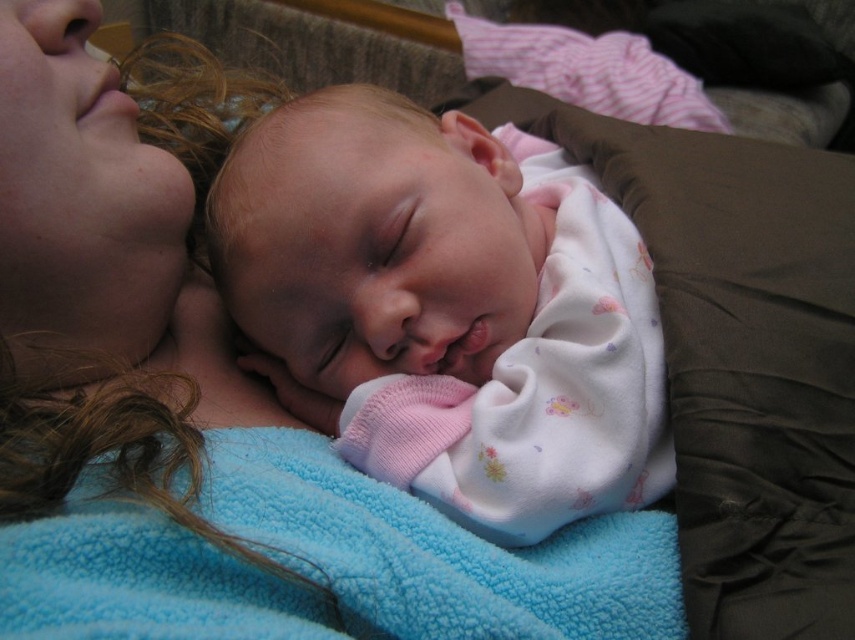
Question: Can you confirm if pink cotton baby at center is positioned above soft blue fleece blanket at upper left?

Choices:
 (A) no
 (B) yes

Answer: (A)

Question: Estimate the real-world distances between objects in this image. Which object is closer to the pink cotton baby at center?

Choices:
 (A) blue fleece blanket at center
 (B) soft blue fleece blanket at upper left

Answer: (A)

Question: Considering the relative positions of pink cotton baby at center and blue fleece blanket at center in the image provided, where is pink cotton baby at center located with respect to blue fleece blanket at center?

Choices:
 (A) left
 (B) right

Answer: (B)

Question: Which point is farther from the camera taking this photo?

Choices:
 (A) (x=329, y=220)
 (B) (x=673, y=536)
 (C) (x=93, y=140)

Answer: (C)

Question: Which of the following is the closest to the observer?

Choices:
 (A) (195, 605)
 (B) (63, 497)

Answer: (A)

Question: Does soft blue fleece blanket at upper left have a greater width compared to blue fleece blanket at center?

Choices:
 (A) yes
 (B) no

Answer: (B)